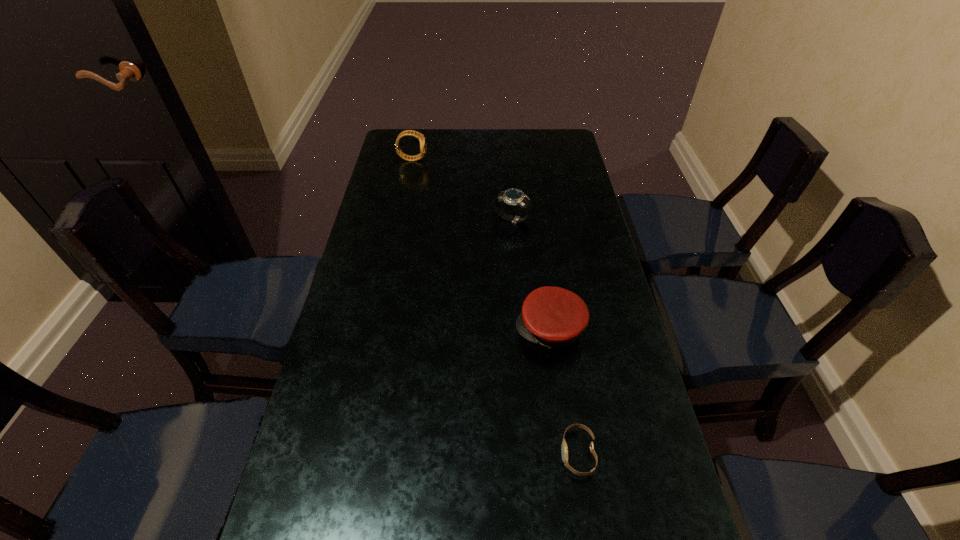
Where is `the leftmost object`? the leftmost object is located at coordinates (422, 139).

Locate an element on the screen. the leftmost watch is located at coordinates (422, 139).

This screenshot has width=960, height=540. In order to click on the second watch from left to right in this screenshot , I will do `click(513, 196)`.

Identify the location of the second nearest watch. (513, 196).

Identify the location of cap. (551, 316).

What are the coordinates of `the third tallest object` in the screenshot? It's located at click(551, 316).

Where is `the shortest watch`? Image resolution: width=960 pixels, height=540 pixels. the shortest watch is located at coordinates (564, 449).

Image resolution: width=960 pixels, height=540 pixels. What are the coordinates of `the nearest watch` in the screenshot? It's located at (564, 449).

Where is `free space located 0.220m on the face of the leftmost object`? The height and width of the screenshot is (540, 960). free space located 0.220m on the face of the leftmost object is located at coordinates (484, 159).

Identify the location of vacant space located 0.050m on the right of the third nearest object. (545, 219).